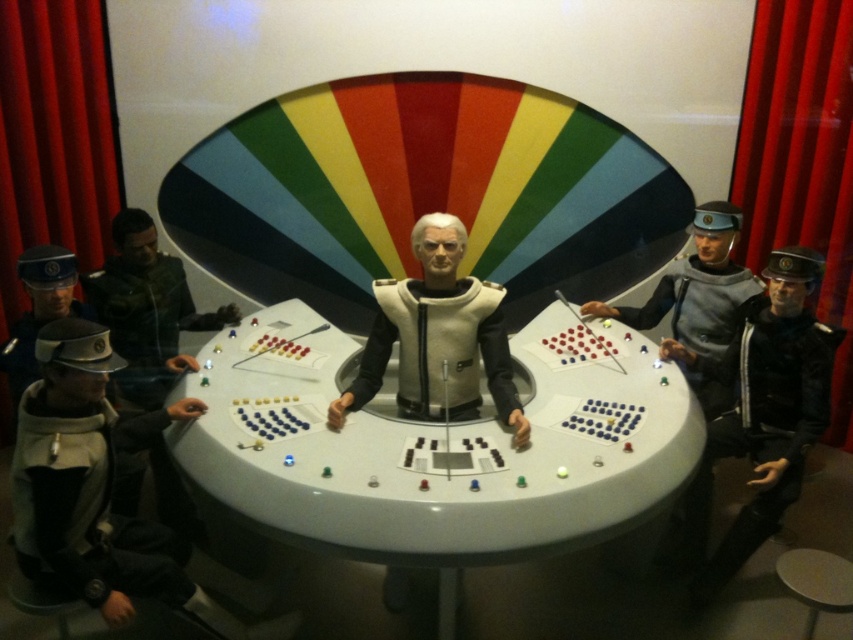
Question: In this image, where is light gray fabric jacket at lower left located relative to white matte astronaut at center?

Choices:
 (A) right
 (B) left

Answer: (B)

Question: Is black leather jacket at lower right thinner than metallic silver uniform at right?

Choices:
 (A) yes
 (B) no

Answer: (A)

Question: Which point is closer to the camera?

Choices:
 (A) light gray fabric jacket at lower left
 (B) black leather jacket at lower right
 (C) white matte astronaut at center
 (D) white plastic round table at center

Answer: (A)

Question: Does white plastic round table at center come behind light gray fabric jacket at lower left?

Choices:
 (A) yes
 (B) no

Answer: (A)

Question: Which of these objects is positioned closest to the metallic silver uniform at right?

Choices:
 (A) black leather jacket at lower right
 (B) white plastic round table at center
 (C) light gray fabric jacket at lower left

Answer: (A)

Question: Which of these objects is positioned farthest from the black leather jacket at lower right?

Choices:
 (A) white plastic round table at center
 (B) light gray fabric jacket at lower left
 (C) white matte astronaut at center

Answer: (B)